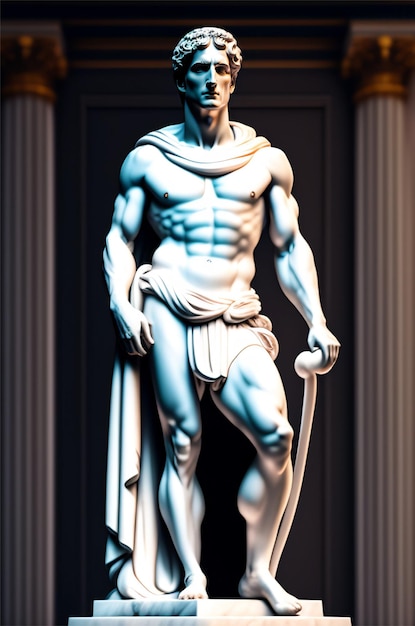
Find the location of a particular element. This screenshot has width=415, height=626. two large pillars is located at coordinates (365, 155), (21, 273).